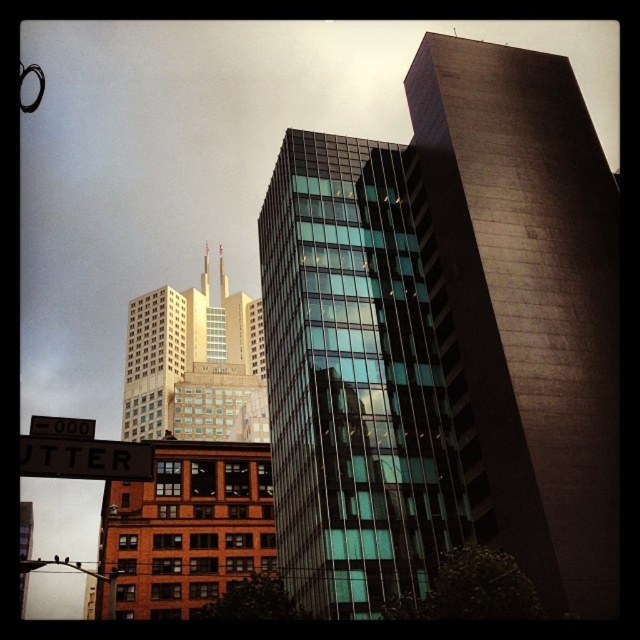
Is glassy steel building at center positioned before brown wooden street sign at lower left?

No, glassy steel building at center is behind brown wooden street sign at lower left.

Which is behind, point (577, 285) or point (140, 470)?

Positioned behind is point (577, 285).

Describe the element at coordinates (445, 339) in the screenshot. I see `glassy steel building at center` at that location.

Locate an element on the screen. The image size is (640, 640). glassy steel building at center is located at coordinates (445, 339).

Does gold glass skyscraper at center appear on the left side of brown wooden street sign at lower left?

Indeed, gold glass skyscraper at center is positioned on the left side of brown wooden street sign at lower left.

Does gold glass skyscraper at center have a greater width compared to brown wooden street sign at lower left?

Yes.

The image size is (640, 640). In order to click on gold glass skyscraper at center in this screenshot , I will do `click(195, 364)`.

Which is more to the left, glassy steel building at center or gold glass skyscraper at center?

gold glass skyscraper at center is more to the left.

Is glassy steel building at center thinner than gold glass skyscraper at center?

Yes, glassy steel building at center is thinner than gold glass skyscraper at center.

Identify the location of glassy steel building at center. (445, 339).